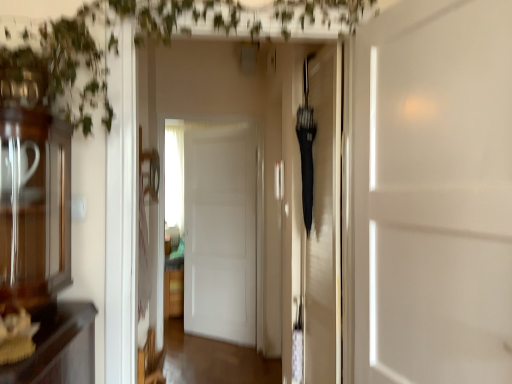
Locate an element on the screen. black matte umbrella at center, marked as the second door in a right-to-left arrangement is located at coordinates (313, 219).

What do you see at coordinates (433, 193) in the screenshot? I see `white matte door at center, the 1th door in the right-to-left sequence` at bounding box center [433, 193].

This screenshot has width=512, height=384. Find the location of `black matte umbrella at center, which is the second door in front-to-back order`. black matte umbrella at center, which is the second door in front-to-back order is located at coordinates (313, 219).

Is black matte umbrella at center, which is the second door in front-to-back order, a part of white matte door at center, which is the first door from back to front?

That's incorrect, black matte umbrella at center, which is the second door in front-to-back order, is not inside white matte door at center, which is the first door from back to front.

From a real-world perspective, does white matte door at center, which is the first door from back to front, stand above black matte umbrella at center, which is counted as the 2th door, starting from the back?

Incorrect, from a real-world perspective, white matte door at center, which is the first door from back to front, is lower than black matte umbrella at center, which is counted as the 2th door, starting from the back.

Considering their positions, is white matte door at center, the 3th door from the front, located in front of or behind black matte umbrella at center, marked as the second door in a right-to-left arrangement?

In the image, white matte door at center, the 3th door from the front, appears behind black matte umbrella at center, marked as the second door in a right-to-left arrangement.

What's the angular difference between white matte door at center, which is the first door from back to front, and black matte umbrella at center, marked as the second door in a right-to-left arrangement,'s facing directions?

The angle between the facing direction of white matte door at center, which is the first door from back to front, and the facing direction of black matte umbrella at center, marked as the second door in a right-to-left arrangement, is 50.8 degrees.

Is white matte door at center, marked as the 3th door in a right-to-left arrangement, beside white matte door at center, placed as the 3th door when sorted from back to front?

There is a gap between white matte door at center, marked as the 3th door in a right-to-left arrangement, and white matte door at center, placed as the 3th door when sorted from back to front.

Identify the location of door that is the 2nd object to the left of the white matte door at center, placed as the 3th door when sorted from back to front, starting at the anchor. This screenshot has height=384, width=512. (220, 231).

Is white matte door at center, which is the first door from back to front, not within white matte door at center, which appears as the third door when viewed from the left?

Absolutely, white matte door at center, which is the first door from back to front, is external to white matte door at center, which appears as the third door when viewed from the left.

The width and height of the screenshot is (512, 384). In order to click on door that is the 2nd object to the right of the green leafy plant at upper left, starting at the anchor in this screenshot , I will do `click(433, 193)`.

Who is shorter, green leafy plant at upper left or white matte door at center, which appears as the third door when viewed from the left?

green leafy plant at upper left is shorter.

Considering the sizes of objects green leafy plant at upper left and white matte door at center, the 1th door in the right-to-left sequence, in the image provided, who is wider, green leafy plant at upper left or white matte door at center, the 1th door in the right-to-left sequence,?

green leafy plant at upper left.

How many degrees apart are the facing directions of green leafy plant at upper left and white matte door at center, placed as the 3th door when sorted from back to front?

The facing directions of green leafy plant at upper left and white matte door at center, placed as the 3th door when sorted from back to front, are 76.2 degrees apart.

Which of these two, white matte door at center, which appears as the third door when viewed from the left, or black matte umbrella at center, which is the second door in front-to-back order, is thinner?

Thinner between the two is black matte umbrella at center, which is the second door in front-to-back order.

Is white matte door at center, arranged as the first door when viewed from the front, not near black matte umbrella at center, which is the second door in front-to-back order?

No, there isn't a large distance between white matte door at center, arranged as the first door when viewed from the front, and black matte umbrella at center, which is the second door in front-to-back order.

From the image's perspective, between white matte door at center, the 1th door in the right-to-left sequence, and black matte umbrella at center, the 2th door positioned from the left, which one is located above?

white matte door at center, the 1th door in the right-to-left sequence.

This screenshot has width=512, height=384. What are the coordinates of `vegetation above the white matte door at center, marked as the 3th door in a right-to-left arrangement (from the image's perspective)` in the screenshot? It's located at (153, 40).

Is point (224, 240) closer or farther from the camera than point (8, 57)?

Clearly, point (224, 240) is more distant from the camera than point (8, 57).

Can you confirm if white matte door at center, which is the first door from back to front, is thinner than green leafy plant at upper left?

Correct, the width of white matte door at center, which is the first door from back to front, is less than that of green leafy plant at upper left.

Is green leafy plant at upper left positioned before black matte umbrella at center, marked as the second door in a right-to-left arrangement?

Yes, green leafy plant at upper left is in front of black matte umbrella at center, marked as the second door in a right-to-left arrangement.

Is green leafy plant at upper left not inside black matte umbrella at center, which is counted as the 2th door, starting from the back?

Yes.

Is green leafy plant at upper left oriented away from black matte umbrella at center, which is counted as the 2th door, starting from the back?

No, green leafy plant at upper left's orientation is not away from black matte umbrella at center, which is counted as the 2th door, starting from the back.

Is white matte door at center, arranged as the first door when viewed from the front, facing away from green leafy plant at upper left?

No, white matte door at center, arranged as the first door when viewed from the front, is not facing the opposite direction of green leafy plant at upper left.

Can you confirm if white matte door at center, the 1th door in the right-to-left sequence, is smaller than green leafy plant at upper left?

Indeed, white matte door at center, the 1th door in the right-to-left sequence, has a smaller size compared to green leafy plant at upper left.

Identify the location of vegetation above the white matte door at center, arranged as the first door when viewed from the front (from a real-world perspective). The image size is (512, 384). (153, 40).

Which of these two, white matte door at center, arranged as the first door when viewed from the front, or green leafy plant at upper left, is wider?

green leafy plant at upper left.

Where is `the 1st door in front of the white matte door at center, marked as the 3th door in a right-to-left arrangement, starting your count from the anchor`? This screenshot has height=384, width=512. the 1st door in front of the white matte door at center, marked as the 3th door in a right-to-left arrangement, starting your count from the anchor is located at coordinates (313, 219).

The image size is (512, 384). I want to click on the 2nd door to the right when counting from the white matte door at center, marked as the 3th door in a right-to-left arrangement, so click(433, 193).

Based on their spatial positions, is white matte door at center, the 3th door from the front, or black matte umbrella at center, which is the second door in front-to-back order, closer to green leafy plant at upper left?

black matte umbrella at center, which is the second door in front-to-back order, is closer to green leafy plant at upper left.

Based on their spatial positions, is white matte door at center, which appears as the third door when viewed from the left, or white matte door at center, the 3th door from the front, closer to black matte umbrella at center, which is the second door in front-to-back order?

white matte door at center, which appears as the third door when viewed from the left, is positioned closer to the anchor black matte umbrella at center, which is the second door in front-to-back order.

Which object lies further to the anchor point black matte umbrella at center, which is counted as the 2th door, starting from the back, white matte door at center, marked as the 3th door in a right-to-left arrangement, or green leafy plant at upper left?

white matte door at center, marked as the 3th door in a right-to-left arrangement, is positioned further to the anchor black matte umbrella at center, which is counted as the 2th door, starting from the back.

Which object lies nearer to the anchor point white matte door at center, which appears as the third door when viewed from the left, green leafy plant at upper left or black matte umbrella at center, marked as the second door in a right-to-left arrangement?

black matte umbrella at center, marked as the second door in a right-to-left arrangement, is closer to white matte door at center, which appears as the third door when viewed from the left.

Estimate the real-world distances between objects in this image. Which object is closer to white matte door at center, marked as the 3th door in a right-to-left arrangement, black matte umbrella at center, which is counted as the 2th door, starting from the back, or green leafy plant at upper left?

black matte umbrella at center, which is counted as the 2th door, starting from the back, is closer to white matte door at center, marked as the 3th door in a right-to-left arrangement.

Considering their positions, is green leafy plant at upper left positioned further to white matte door at center, placed as the 3th door when sorted from back to front, than white matte door at center, which is the first door from back to front?

white matte door at center, which is the first door from back to front, is further to white matte door at center, placed as the 3th door when sorted from back to front.

Based on their spatial positions, is white matte door at center, placed as the 3th door when sorted from back to front, or green leafy plant at upper left further from white matte door at center, which is the first door from back to front?

Answer: The object further to white matte door at center, which is the first door from back to front, is white matte door at center, placed as the 3th door when sorted from back to front.

In the scene shown: From the image, which object appears to be nearer to white matte door at center, which ranks as the 1th door in left-to-right order, black matte umbrella at center, marked as the second door in a right-to-left arrangement, or white matte door at center, the 1th door in the right-to-left sequence?

black matte umbrella at center, marked as the second door in a right-to-left arrangement, is positioned closer to the anchor white matte door at center, which ranks as the 1th door in left-to-right order.

Locate an element on the screen. vegetation between white matte door at center, arranged as the first door when viewed from the front, and black matte umbrella at center, the 2th door positioned from the left, along the z-axis is located at coordinates (153, 40).

Find the location of a particular element. The height and width of the screenshot is (384, 512). vegetation between white matte door at center, placed as the 3th door when sorted from back to front, and white matte door at center, marked as the 3th door in a right-to-left arrangement, in the front-back direction is located at coordinates (153, 40).

Find the location of `door between white matte door at center, arranged as the first door when viewed from the front, and white matte door at center, marked as the 3th door in a right-to-left arrangement, along the z-axis`. door between white matte door at center, arranged as the first door when viewed from the front, and white matte door at center, marked as the 3th door in a right-to-left arrangement, along the z-axis is located at coordinates (313, 219).

Where is `door between green leafy plant at upper left and white matte door at center, marked as the 3th door in a right-to-left arrangement, from front to back`? The image size is (512, 384). door between green leafy plant at upper left and white matte door at center, marked as the 3th door in a right-to-left arrangement, from front to back is located at coordinates (313, 219).